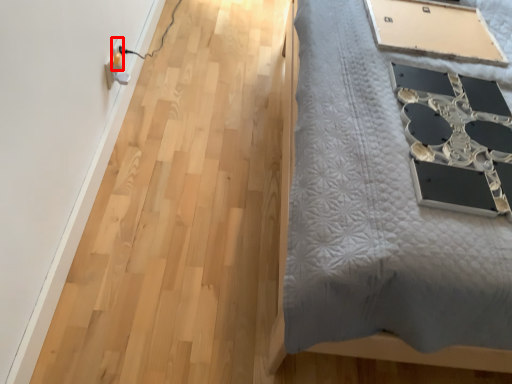
Question: From the image's perspective, where is electric outlet (annotated by the red box) located in relation to table in the image?

Choices:
 (A) below
 (B) above

Answer: (A)